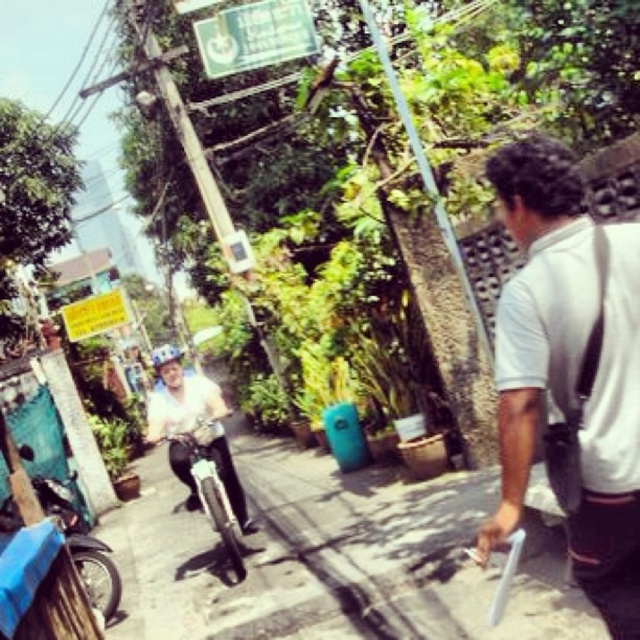
Is the position of white matte helmet at center more distant than that of shiny silver motorcycle at center?

Yes, it is behind shiny silver motorcycle at center.

Is the position of white matte helmet at center less distant than that of shiny silver motorcycle at center?

No, white matte helmet at center is behind shiny silver motorcycle at center.

Which is in front, point (202, 419) or point (204, 454)?

Point (204, 454)

Find the location of a particular element. Image resolution: width=640 pixels, height=640 pixels. white matte helmet at center is located at coordinates (193, 426).

Who is positioned more to the left, smooth concrete pavement at center or white matte helmet at center?

Positioned to the left is white matte helmet at center.

Measure the distance between smooth concrete pavement at center and white matte helmet at center.

smooth concrete pavement at center and white matte helmet at center are 4.81 feet apart from each other.

In order to click on smooth concrete pavement at center in this screenshot , I will do `click(326, 560)`.

Which is behind, point (237, 520) or point (268, 36)?

Positioned behind is point (268, 36).

Is point (196, 426) more distant than point (227, 13)?

That is False.

Where is `white matte helmet at center`? This screenshot has height=640, width=640. white matte helmet at center is located at coordinates (193, 426).